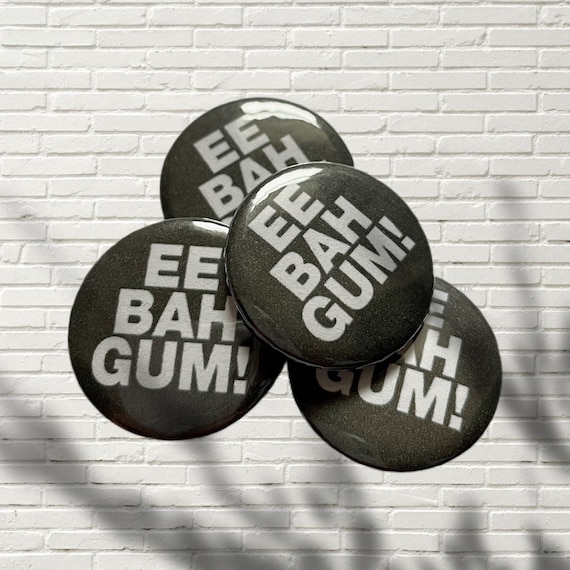
Locate an element on the screen. The height and width of the screenshot is (570, 570). wall is located at coordinates (297, 59).